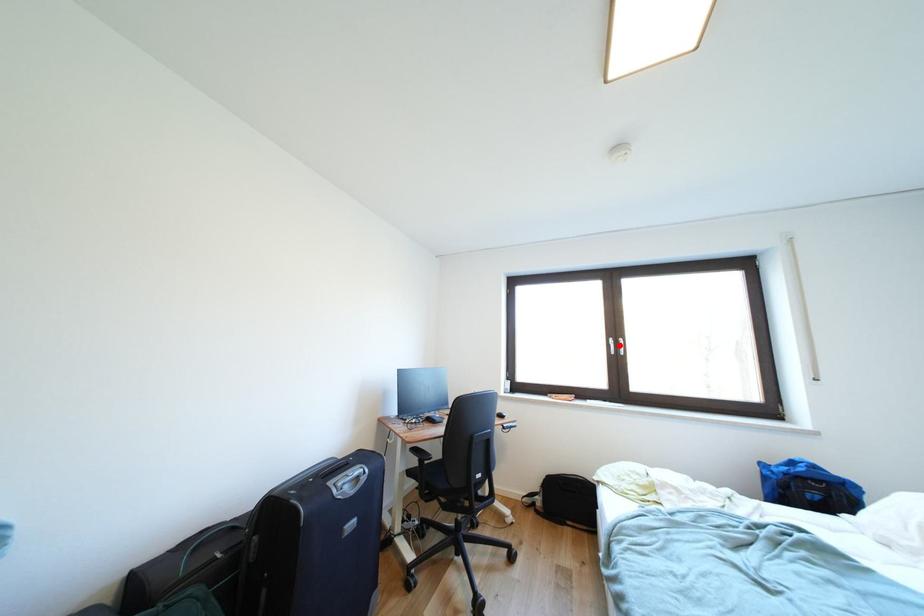
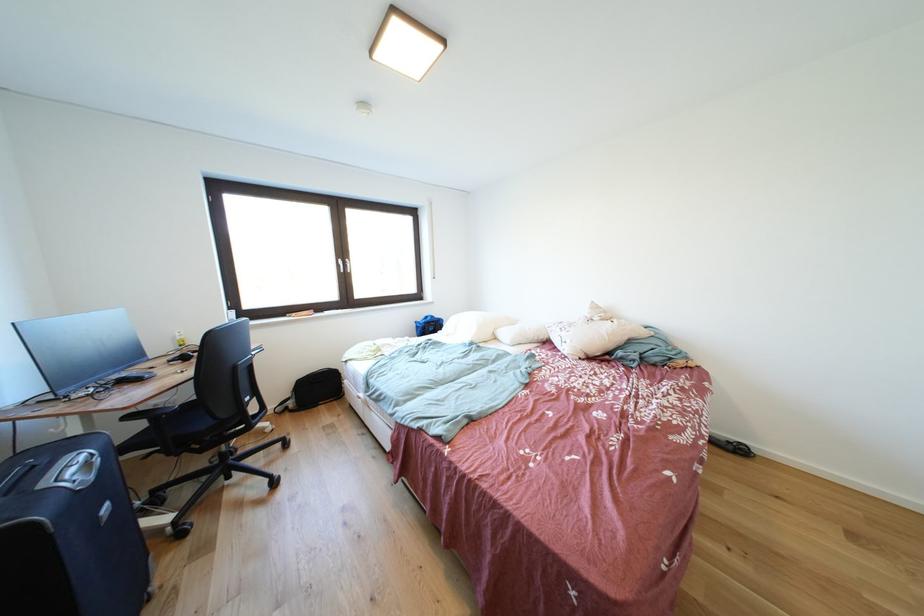
Question: I am providing you with two images of the same scene from different viewpoints. Given a red point in image1, look at the same physical point in image2. Is it:

Choices:
 (A) Closer to the viewpoint
 (B) Farther from the viewpoint

Answer: (A)